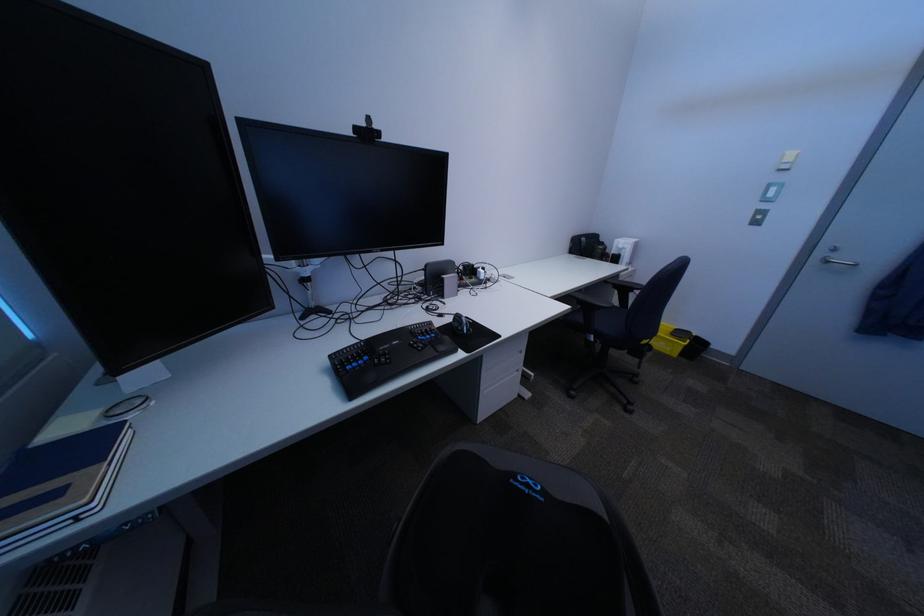
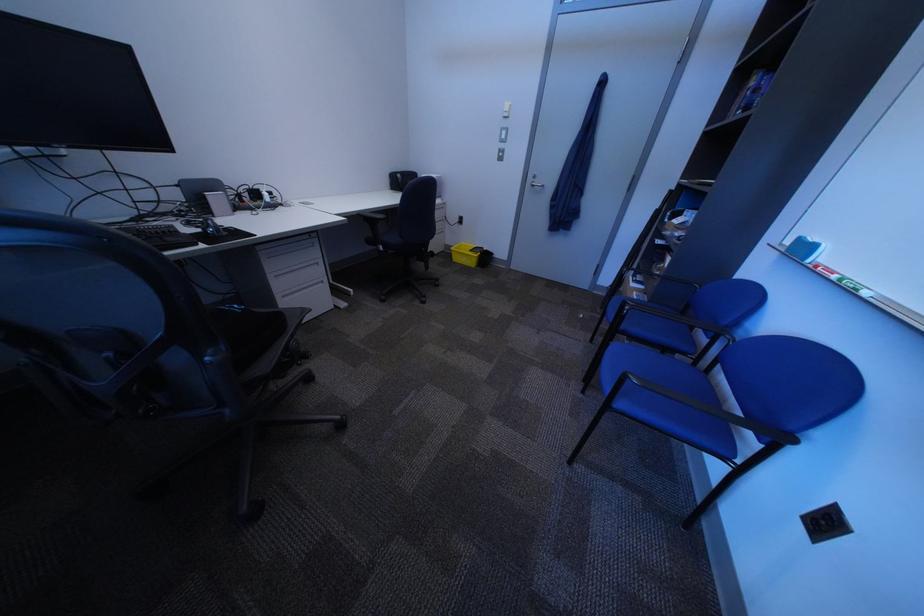
Locate, in the second image, the point that corresponds to point 554,487 in the first image.

(259, 309)